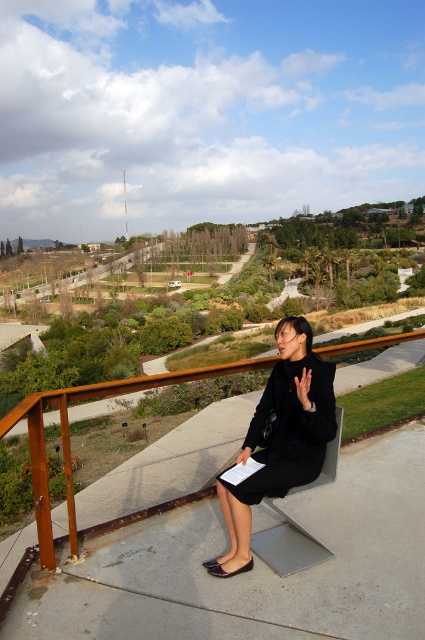
Question: Which object appears closest to the camera in this image?

Choices:
 (A) black matte dress at center
 (B) brown wooden rail at upper center

Answer: (B)

Question: Does black matte dress at center have a smaller size compared to brown wooden rail at upper center?

Choices:
 (A) yes
 (B) no

Answer: (A)

Question: Is black matte dress at center behind brown wooden rail at upper center?

Choices:
 (A) yes
 (B) no

Answer: (A)

Question: Which of the following is the closest to the observer?

Choices:
 (A) (56, 401)
 (B) (283, 397)

Answer: (A)

Question: Among these points, which one is nearest to the camera?

Choices:
 (A) (241, 483)
 (B) (68, 493)

Answer: (A)

Question: Can you confirm if black matte dress at center is positioned to the right of brown wooden rail at upper center?

Choices:
 (A) yes
 (B) no

Answer: (B)